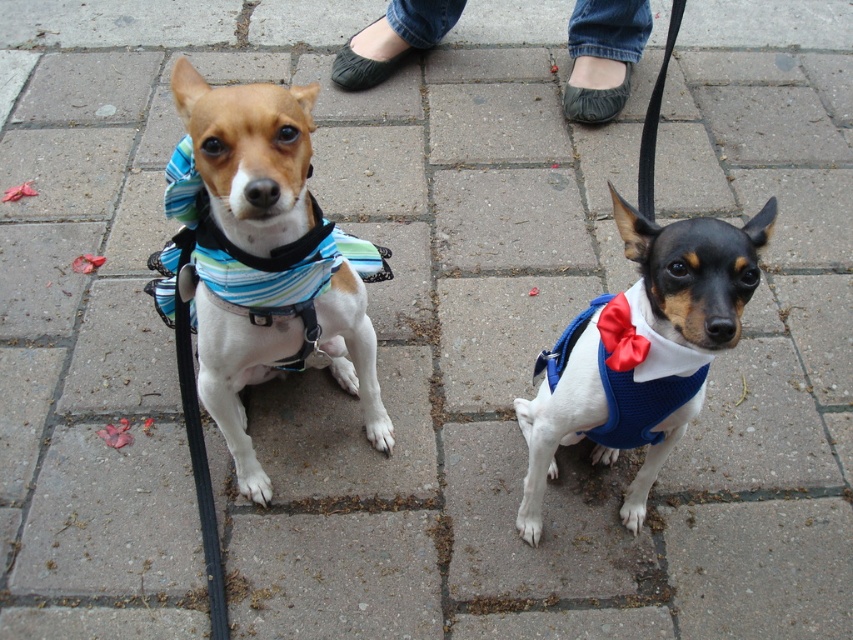
You are standing at the origin point of the coordinate system. You see a blue knitted vest at center located at point [646,355]. If you move 0.1 units to the right along the x axis, will you be closer to the blue knitted vest at center?

Moving 0.1 units to the right along the x axis from the origin point would take you to coordinate 0.1, 0.0. The blue knitted vest at center is located at [646,355]. Since the vest is further to the right and up compared to the new position, you would not be closer to it.

You are a dog trainer observing two dogs. You notice the blue striped fabric harness at center and the satin blue bow tie at center. Which of these items is located more to the left?

The blue striped fabric harness at center is positioned on the left side of the satin blue bow tie at center, so it is more to the left.

You are a photographer trying to capture a closeup shot of the blue knitted vest at center. Given that your camera has a minimum focusing distance of 40 inches, will you be able to take the photo without moving closer?

The blue knitted vest at center is 39.34 inches from the camera, which is within the minimum focusing distance of 40 inches. Therefore, you can take the photo without moving closer.